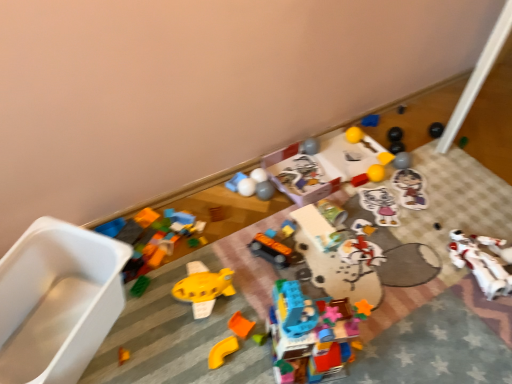
Question: Is orange matte plastic toy at lower center, the third toy when ordered from left to right, inside or outside of orange matte block at center, which is the thirteenth toy from right to left?

Choices:
 (A) inside
 (B) outside

Answer: (B)

Question: Is orange matte plastic toy at lower center, the third toy when ordered from left to right, in front of or behind orange matte block at center, which is the thirteenth toy from right to left, in the image?

Choices:
 (A) front
 (B) behind

Answer: (A)

Question: Estimate the real-world distances between objects in this image. Which object is farther from the translucent plastic building blocks at center, which ranks as the ninth toy in right-to-left order?

Choices:
 (A) matte black car at center, the tenth toy positioned from the right
 (B) white plastic robot at lower right, which appears as the seventeenth toy when viewed from the left
 (C) yellow matte toy boat at center, which ranks as the 16th toy in right-to-left order
 (D) metallic silver can at center, arranged as the 7th toy when viewed from the right
 (E) matte plastic blocks at upper center, the fourteenth toy in the right-to-left sequence

Answer: (E)

Question: Estimate the real-world distances between objects in this image. Which object is closer to the matte plastic blocks at upper center, the fourteenth toy in the right-to-left sequence?

Choices:
 (A) white plastic container at left, the seventeenth toy when ordered from right to left
 (B) orange matte plastic toy at lower center, the third toy when ordered from left to right
 (C) matte plastic sticker at center, positioned as the 16th toy in left-to-right order
 (D) matte black car at center, the tenth toy positioned from the right
 (E) blue matte block at upper center, the fourteenth toy from the left

Answer: (D)